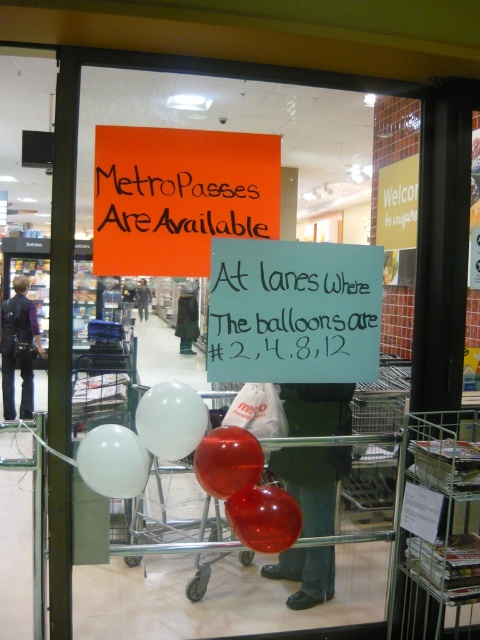
Question: Which object is closer to the camera taking this photo?

Choices:
 (A) white matte balloon at center
 (B) shiny red balloon at center
 (C) orange paper sign at upper center
 (D) white glossy balloon at lower left

Answer: (D)

Question: From the image, what is the correct spatial relationship of white chalk sign at center in relation to matte black jacket at upper center?

Choices:
 (A) below
 (B) above

Answer: (A)

Question: Which point appears closest to the camera in this image?

Choices:
 (A) (4, 332)
 (B) (133, 211)

Answer: (B)

Question: Is shiny red balloon at center wider than dark blue jeans at left?

Choices:
 (A) yes
 (B) no

Answer: (B)

Question: Which point appears farthest from the camera in this image?

Choices:
 (A) (249, 234)
 (B) (16, 275)

Answer: (B)

Question: Does white matte balloon at center have a larger size compared to dark blue jeans at left?

Choices:
 (A) yes
 (B) no

Answer: (B)